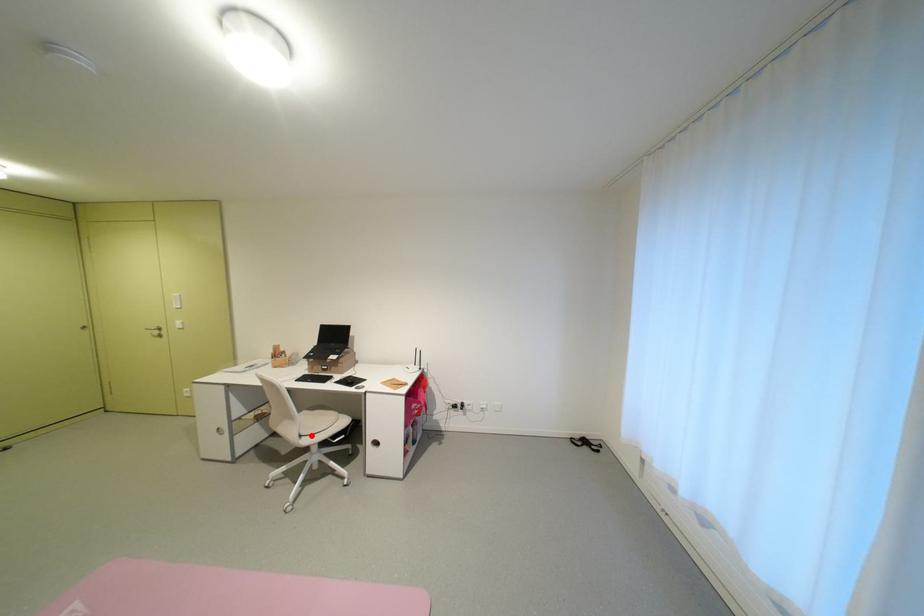
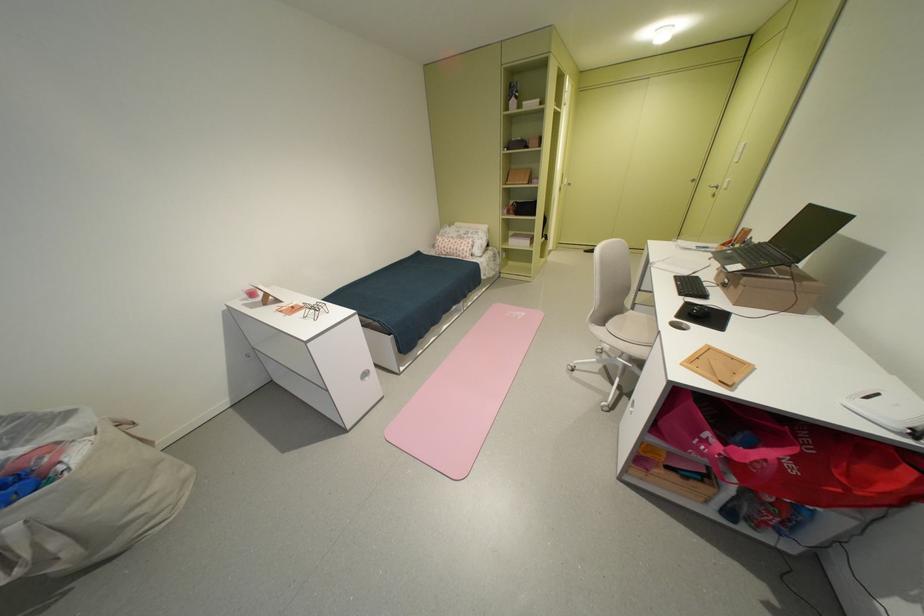
In the second image, find the point that corresponds to the highlighted location in the first image.

(615, 326)